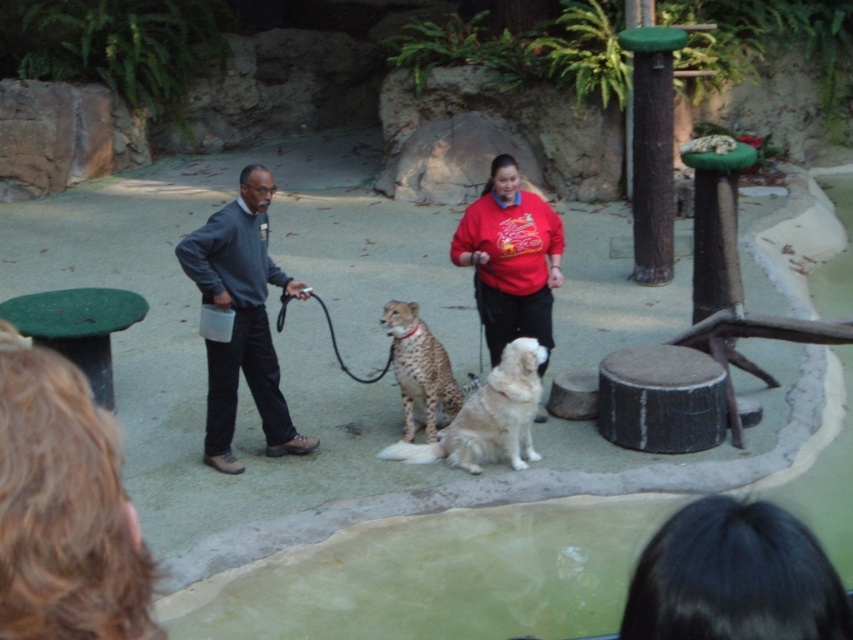
What is the color of the clothing item located at the coordinates point (509, 259)?

The point (509, 259) marks the red cotton shirt at center, so the clothing item there is red.

You are a zookeeper standing in the center of the enclosure. You need to locate the red cotton shirt at center. Where would you find it?

The red cotton shirt at center is located at the coordinates point (x=509, y=259).

Based on the photo, you are a zookeeper trying to locate a specific point in the enclosure. The dark gray sweater at left is located at point (x=241, y=320). Can you confirm if this point is where the cheetah is sitting?

The dark gray sweater at left is located at point (x=241, y=320), which is the same location as the cheetah sitting in the center of the scene. Therefore, the point corresponds to where the cheetah is sitting.